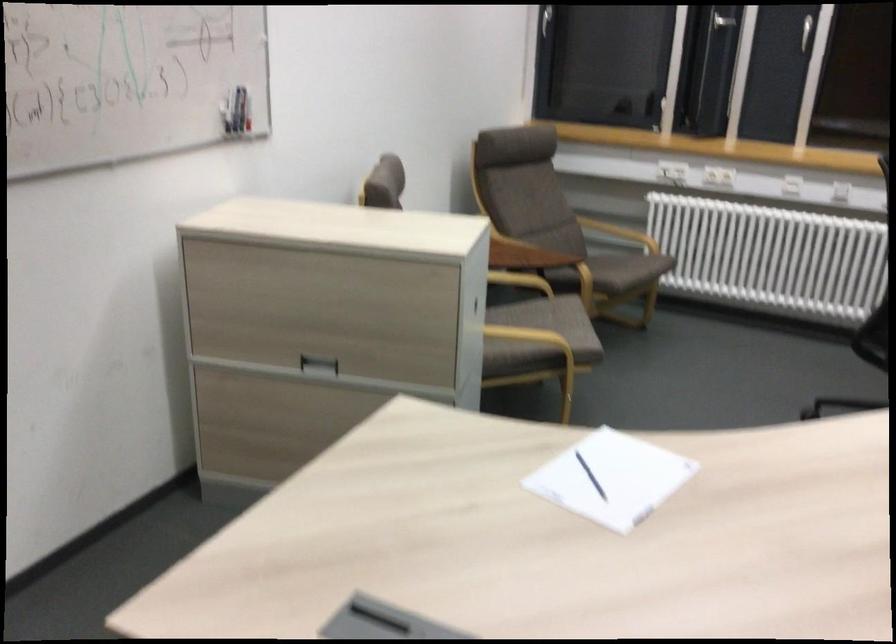
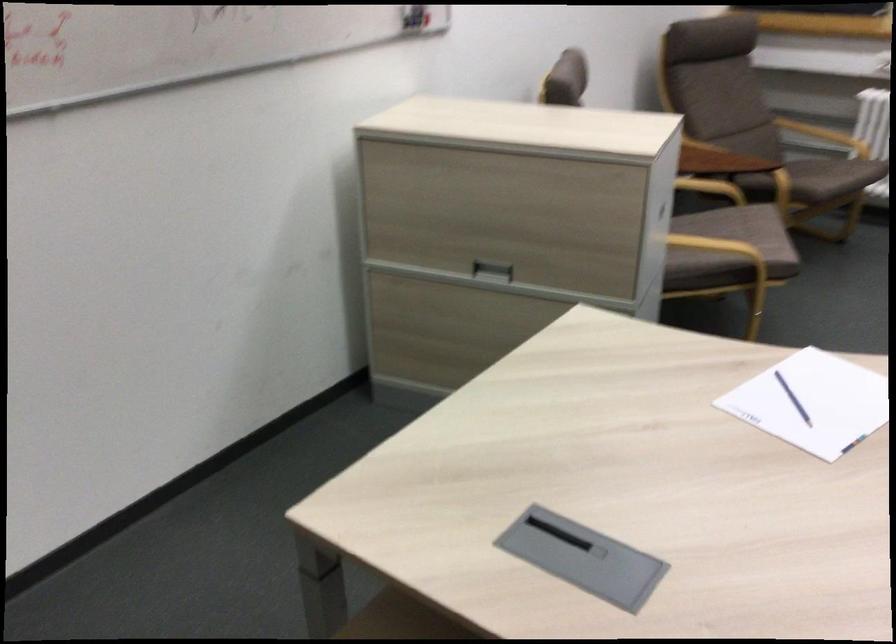
Locate, in the second image, the point that corresponds to (586,474) in the first image.

(793, 399)